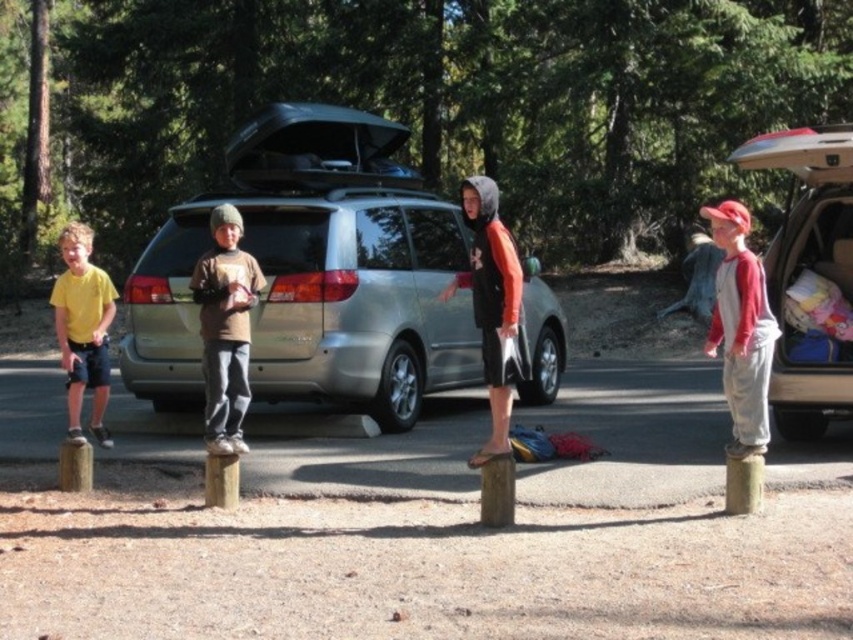
Is brown cotton shirt at center wider than yellow t-shirt at left?

Incorrect, brown cotton shirt at center's width does not surpass yellow t-shirt at left's.

Is point (218, 282) closer to camera compared to point (90, 248)?

Yes, it is in front of point (90, 248).

Find the location of a particular element. This screenshot has width=853, height=640. brown cotton shirt at center is located at coordinates (225, 328).

Between silver metallic minivan at center and brown cotton shirt at center, which one has less height?

With less height is brown cotton shirt at center.

Does point (554, 358) come farther from viewer compared to point (215, 324)?

Yes, point (554, 358) is farther from viewer.

What are the coordinates of `silver metallic minivan at center` in the screenshot? It's located at (315, 273).

Can you confirm if silver metallic minivan at center is shorter than red and white baseball cap at right?

Yes.

Who is more distant from viewer, (x=422, y=378) or (x=770, y=339)?

Point (x=422, y=378)

This screenshot has height=640, width=853. I want to click on silver metallic minivan at center, so click(x=315, y=273).

Identify the location of silver metallic minivan at center. The image size is (853, 640). (315, 273).